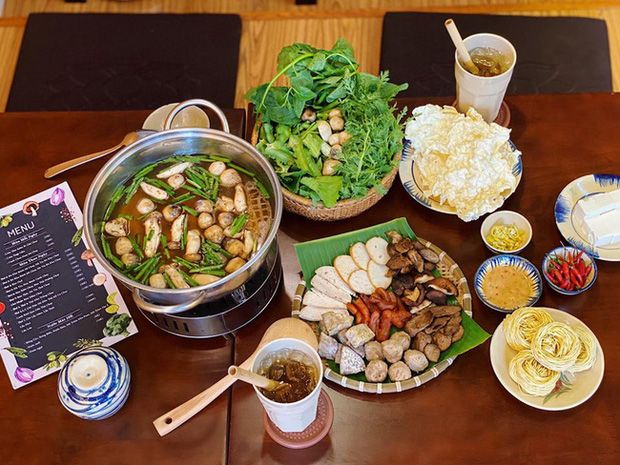
The height and width of the screenshot is (465, 620). In order to click on cup holder in this screenshot , I will do `click(314, 418)`, `click(503, 124)`.